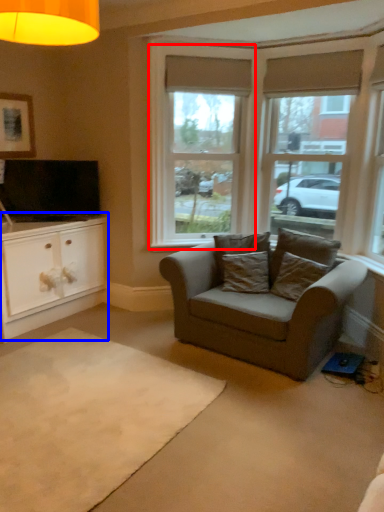
Question: Which object appears farthest to the camera in this image, window (highlighted by a red box) or cabinetry (highlighted by a blue box)?

Choices:
 (A) window
 (B) cabinetry

Answer: (A)